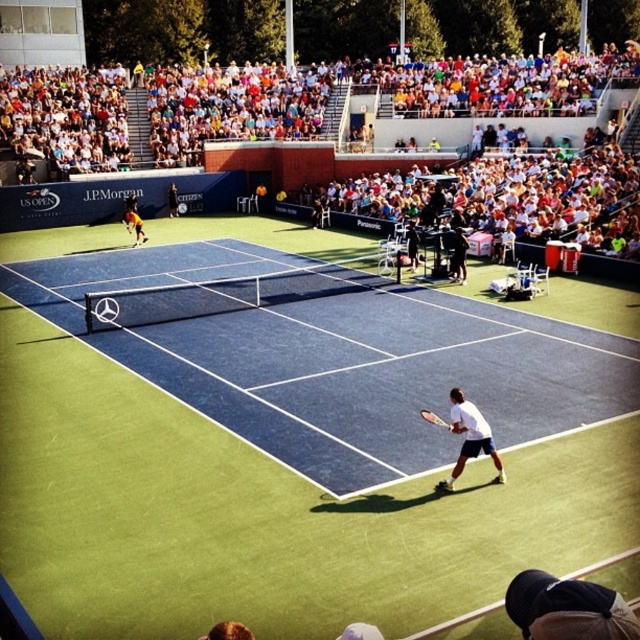
Does yellow-orange tennis racket at upper left appear on the right side of white matte tennis racket at lower center?

Incorrect, yellow-orange tennis racket at upper left is not on the right side of white matte tennis racket at lower center.

Is yellow-orange tennis racket at upper left to the left of white matte tennis racket at lower center from the viewer's perspective?

Correct, you'll find yellow-orange tennis racket at upper left to the left of white matte tennis racket at lower center.

Is point (141, 224) in front of point (442, 424)?

That is False.

The height and width of the screenshot is (640, 640). Identify the location of yellow-orange tennis racket at upper left. (134, 225).

Between multicolored fabric crowd at upper center and white matte tennis racket at lower center, which one is positioned higher?

multicolored fabric crowd at upper center is higher up.

Measure the distance from multicolored fabric crowd at upper center to white matte tennis racket at lower center.

29.86 meters

Locate an element on the screen. This screenshot has width=640, height=640. multicolored fabric crowd at upper center is located at coordinates (157, 113).

In the scene shown: Who is positioned more to the right, white matte tennis racket at right or white matte tennis racket at lower center?

white matte tennis racket at right

Does white matte tennis racket at right have a lesser width compared to white matte tennis racket at lower center?

No, white matte tennis racket at right is not thinner than white matte tennis racket at lower center.

Is point (477, 452) positioned in front of point (449, 428)?

Yes, point (477, 452) is closer to viewer.

The width and height of the screenshot is (640, 640). What are the coordinates of `white matte tennis racket at right` in the screenshot? It's located at (468, 438).